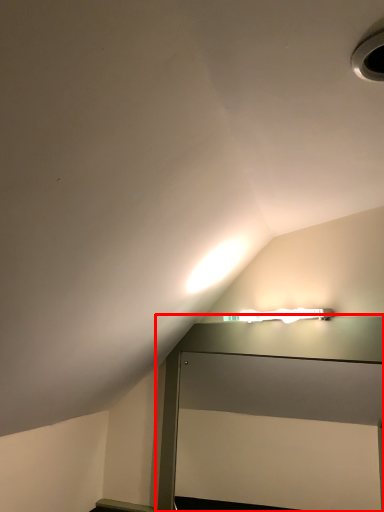
Question: From the image's perspective, what is the correct spatial positioning of table (annotated by the red box) in reference to hole?

Choices:
 (A) above
 (B) below

Answer: (B)